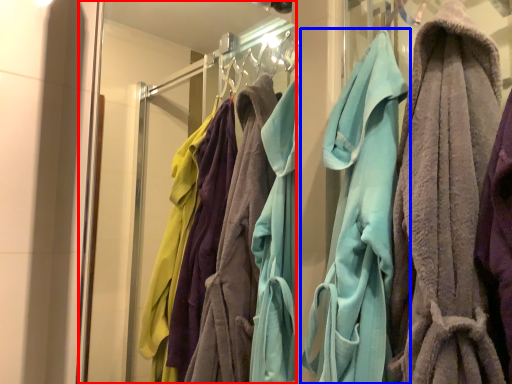
Question: Among these objects, which one is nearest to the camera, glass door (highlighted by a red box) or towel (highlighted by a blue box)?

Choices:
 (A) glass door
 (B) towel

Answer: (A)